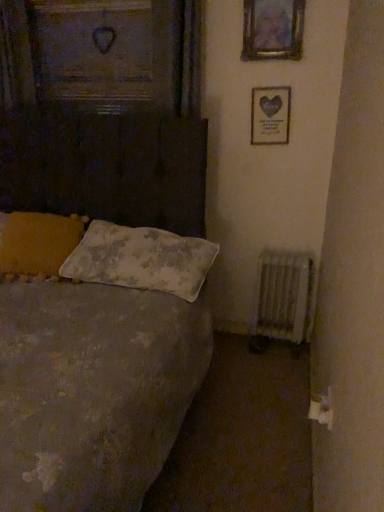
Measure the distance between matte silver picture frame at upper right, which is counted as the first picture frame, starting from the bottom, and camera.

matte silver picture frame at upper right, which is counted as the first picture frame, starting from the bottom, is 2.31 meters away from camera.

Locate an element on the screen. The image size is (384, 512). fluffy white pillow at left, the second pillow in the right-to-left sequence is located at coordinates (37, 243).

I want to click on textured gray bed at left, so click(92, 392).

In order to click on metallic silver picture frame at upper center, the first picture frame in the top-to-bottom sequence in this screenshot , I will do `click(273, 29)`.

From the matte silver picture frame at upper right, which is counted as the second picture frame, starting from the top, count the 1st pillow to the left and point to it. Please provide its 2D coordinates.

[(141, 259)]

Could you tell me if white textured pillow at center, arranged as the 1th pillow when viewed from the right, is turned towards matte silver picture frame at upper right, the 2th picture frame in the front-to-back sequence?

No.

Considering the positions of objects white textured pillow at center, which is the 2th pillow from left to right, and matte silver picture frame at upper right, which is counted as the first picture frame, starting from the bottom, in the image provided, who is more to the right, white textured pillow at center, which is the 2th pillow from left to right, or matte silver picture frame at upper right, which is counted as the first picture frame, starting from the bottom,?

From the viewer's perspective, matte silver picture frame at upper right, which is counted as the first picture frame, starting from the bottom, appears more on the right side.

From a real-world perspective, between fluffy white pillow at left, which is the 1th pillow in left-to-right order, and metallic silver picture frame at upper center, the first picture frame in the top-to-bottom sequence, who is vertically lower?

In real-world perspective, fluffy white pillow at left, which is the 1th pillow in left-to-right order, is lower.

Considering the sizes of objects fluffy white pillow at left, which is the 1th pillow in left-to-right order, and metallic silver picture frame at upper center, the first picture frame in the top-to-bottom sequence, in the image provided, who is shorter, fluffy white pillow at left, which is the 1th pillow in left-to-right order, or metallic silver picture frame at upper center, the first picture frame in the top-to-bottom sequence,?

With less height is fluffy white pillow at left, which is the 1th pillow in left-to-right order.

Considering the sizes of objects fluffy white pillow at left, which is the 1th pillow in left-to-right order, and metallic silver picture frame at upper center, the first picture frame in the top-to-bottom sequence, in the image provided, who is thinner, fluffy white pillow at left, which is the 1th pillow in left-to-right order, or metallic silver picture frame at upper center, the first picture frame in the top-to-bottom sequence,?

With smaller width is metallic silver picture frame at upper center, the first picture frame in the top-to-bottom sequence.

Where is `pillow that is the 1st object located in front of the metallic silver picture frame at upper center, marked as the second picture frame in a back-to-front arrangement`? This screenshot has height=512, width=384. pillow that is the 1st object located in front of the metallic silver picture frame at upper center, marked as the second picture frame in a back-to-front arrangement is located at coordinates (37, 243).

Is matte silver picture frame at upper right, which appears as the 1th picture frame when viewed from the back, oriented towards white textured radiator at lower right?

No, matte silver picture frame at upper right, which appears as the 1th picture frame when viewed from the back, does not turn towards white textured radiator at lower right.

How different are the orientations of matte silver picture frame at upper right, the 2th picture frame in the front-to-back sequence, and white textured radiator at lower right in degrees?

2.66 degrees separate the facing orientations of matte silver picture frame at upper right, the 2th picture frame in the front-to-back sequence, and white textured radiator at lower right.

From a real-world perspective, which is physically above, matte silver picture frame at upper right, the 2th picture frame in the front-to-back sequence, or white textured radiator at lower right?

From a 3D spatial view, matte silver picture frame at upper right, the 2th picture frame in the front-to-back sequence, is above.

Is matte silver picture frame at upper right, which is counted as the first picture frame, starting from the bottom, to the left of white textured radiator at lower right from the viewer's perspective?

Yes, matte silver picture frame at upper right, which is counted as the first picture frame, starting from the bottom, is to the left of white textured radiator at lower right.

Is textured gray bed at left turned away from white textured radiator at lower right?

No, textured gray bed at left's orientation is not away from white textured radiator at lower right.

Considering the sizes of objects textured gray bed at left and white textured radiator at lower right in the image provided, who is wider, textured gray bed at left or white textured radiator at lower right?

With larger width is textured gray bed at left.

Between textured gray bed at left and white textured radiator at lower right, which one has larger size?

Bigger between the two is textured gray bed at left.

Which is in front, point (89, 115) or point (262, 288)?

The point (89, 115) is more forward.

Choose the correct answer: Is textured gray bed at left inside metallic silver picture frame at upper center, the first picture frame in the top-to-bottom sequence, or outside it?

textured gray bed at left is not enclosed by metallic silver picture frame at upper center, the first picture frame in the top-to-bottom sequence.

In terms of width, does textured gray bed at left look wider or thinner when compared to metallic silver picture frame at upper center, arranged as the second picture frame when ordered from the bottom?

textured gray bed at left is wider than metallic silver picture frame at upper center, arranged as the second picture frame when ordered from the bottom.

Between textured gray bed at left and metallic silver picture frame at upper center, the first picture frame from the front, which one has less height?

metallic silver picture frame at upper center, the first picture frame from the front.

Is metallic silver picture frame at upper center, marked as the second picture frame in a back-to-front arrangement, aimed at white textured radiator at lower right?

No, metallic silver picture frame at upper center, marked as the second picture frame in a back-to-front arrangement, is not facing towards white textured radiator at lower right.

From the image's perspective, is metallic silver picture frame at upper center, marked as the second picture frame in a back-to-front arrangement, on top of white textured radiator at lower right?

Indeed, from the image's perspective, metallic silver picture frame at upper center, marked as the second picture frame in a back-to-front arrangement, is shown above white textured radiator at lower right.

Between point (302, 10) and point (296, 284), which one is positioned behind?

Point (296, 284)

From a real-world perspective, who is located higher, metallic silver picture frame at upper center, the first picture frame in the top-to-bottom sequence, or white textured radiator at lower right?

From a 3D spatial view, metallic silver picture frame at upper center, the first picture frame in the top-to-bottom sequence, is above.

In the scene shown: Would you say white textured radiator at lower right is to the left or to the right of metallic silver picture frame at upper center, arranged as the second picture frame when ordered from the bottom, in the picture?

white textured radiator at lower right is positioned on metallic silver picture frame at upper center, arranged as the second picture frame when ordered from the bottom,'s right side.

Can you confirm if white textured radiator at lower right is shorter than metallic silver picture frame at upper center, arranged as the second picture frame when ordered from the bottom?

No.

Which is less distant, (278, 300) or (289, 12)?

Point (278, 300) is positioned farther from the camera compared to point (289, 12).

From the picture: How distant is white textured radiator at lower right from metallic silver picture frame at upper center, arranged as the second picture frame when ordered from the bottom?

white textured radiator at lower right and metallic silver picture frame at upper center, arranged as the second picture frame when ordered from the bottom, are 1.30 meters apart from each other.

You are a GUI agent. You are given a task and a screenshot of the screen. Output one action in this format:
    pyautogui.click(x=<x>, y=<y>)
    Task: Click on the 1st picture frame directly above the white textured pillow at center, arranged as the 1th pillow when viewed from the right (from a real-world perspective)
    
    Given the screenshot: What is the action you would take?
    pyautogui.click(x=270, y=115)

From the fluffy white pillow at left, which is the 1th pillow in left-to-right order, count 1st picture frames backward and point to it. Please provide its 2D coordinates.

[(273, 29)]

Which object lies further to the anchor point matte silver picture frame at upper right, the 2th picture frame in the front-to-back sequence, metallic silver picture frame at upper center, marked as the second picture frame in a back-to-front arrangement, or white textured radiator at lower right?

white textured radiator at lower right lies further to matte silver picture frame at upper right, the 2th picture frame in the front-to-back sequence, than the other object.

Looking at the image, which one is located further to white textured radiator at lower right, metallic silver picture frame at upper center, marked as the second picture frame in a back-to-front arrangement, or white textured pillow at center, which is the 2th pillow from left to right?

Among the two, metallic silver picture frame at upper center, marked as the second picture frame in a back-to-front arrangement, is located further to white textured radiator at lower right.

Estimate the real-world distances between objects in this image. Which object is closer to fluffy white pillow at left, which is the 1th pillow in left-to-right order, white textured radiator at lower right or white textured pillow at center, which is the 2th pillow from left to right?

Among the two, white textured pillow at center, which is the 2th pillow from left to right, is located nearer to fluffy white pillow at left, which is the 1th pillow in left-to-right order.

In the scene shown: Looking at the image, which one is located closer to white textured radiator at lower right, metallic silver picture frame at upper center, arranged as the second picture frame when ordered from the bottom, or fluffy white pillow at left, the second pillow in the right-to-left sequence?

fluffy white pillow at left, the second pillow in the right-to-left sequence, is closer to white textured radiator at lower right.

When comparing their distances from white textured radiator at lower right, does metallic silver picture frame at upper center, the first picture frame in the top-to-bottom sequence, or matte silver picture frame at upper right, which is counted as the second picture frame, starting from the top, seem closer?

The object closer to white textured radiator at lower right is matte silver picture frame at upper right, which is counted as the second picture frame, starting from the top.

Estimate the real-world distances between objects in this image. Which object is closer to fluffy white pillow at left, which is the 1th pillow in left-to-right order, metallic silver picture frame at upper center, arranged as the second picture frame when ordered from the bottom, or white textured radiator at lower right?

white textured radiator at lower right.

Considering their positions, is white textured radiator at lower right positioned further to textured gray bed at left than metallic silver picture frame at upper center, marked as the second picture frame in a back-to-front arrangement?

Among the two, metallic silver picture frame at upper center, marked as the second picture frame in a back-to-front arrangement, is located further to textured gray bed at left.

When comparing their distances from metallic silver picture frame at upper center, the first picture frame from the front, does fluffy white pillow at left, which is the 1th pillow in left-to-right order, or matte silver picture frame at upper right, the 2th picture frame in the front-to-back sequence, seem further?

Among the two, fluffy white pillow at left, which is the 1th pillow in left-to-right order, is located further to metallic silver picture frame at upper center, the first picture frame from the front.

Locate an element on the screen. pillow between metallic silver picture frame at upper center, the first picture frame from the front, and white textured pillow at center, arranged as the 1th pillow when viewed from the right, vertically is located at coordinates (37, 243).

Find the location of a particular element. The height and width of the screenshot is (512, 384). picture frame between metallic silver picture frame at upper center, the first picture frame in the top-to-bottom sequence, and white textured pillow at center, arranged as the 1th pillow when viewed from the right, vertically is located at coordinates (270, 115).

Image resolution: width=384 pixels, height=512 pixels. Identify the location of pillow located between textured gray bed at left and fluffy white pillow at left, the second pillow in the right-to-left sequence, in the depth direction. (141, 259).

The height and width of the screenshot is (512, 384). Find the location of `picture frame between fluffy white pillow at left, which is the 1th pillow in left-to-right order, and matte silver picture frame at upper right, which is counted as the second picture frame, starting from the top, from left to right`. picture frame between fluffy white pillow at left, which is the 1th pillow in left-to-right order, and matte silver picture frame at upper right, which is counted as the second picture frame, starting from the top, from left to right is located at coordinates (273, 29).